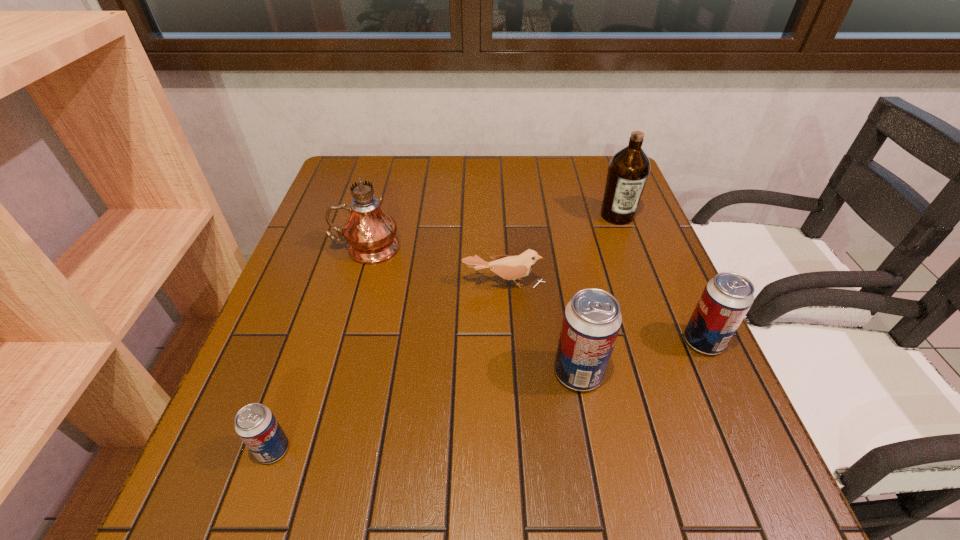
Please point a spot to place another beer_can for symmetrical spacing. Please provide its 2D coordinates. Your answer should be formatted as a tuple, i.e. [(x, y)], where the tuple contains the x and y coordinates of a point satisfying the conditions above.

[(436, 408)]